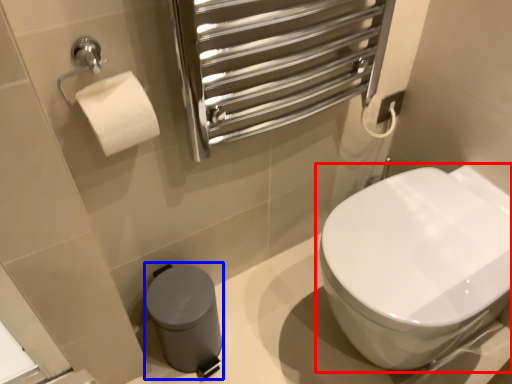
Question: Among these objects, which one is farthest to the camera, toilet (highlighted by a red box) or porcelain (highlighted by a blue box)?

Choices:
 (A) toilet
 (B) porcelain

Answer: (B)